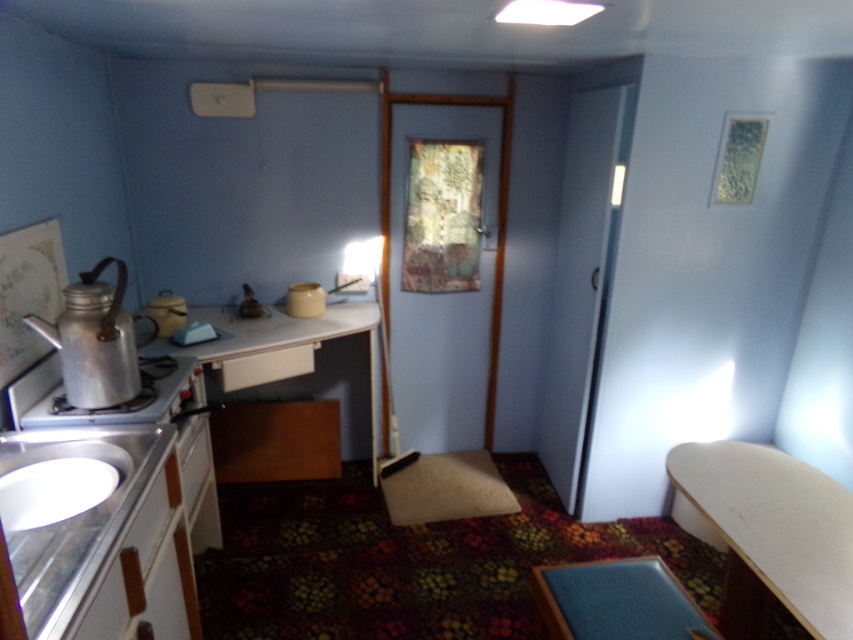
You are trying to place a 12 inch wide baking tray between the white glossy sink at lower left and the silver metallic stove at lower left. Will it fit?

The distance between the white glossy sink at lower left and the silver metallic stove at lower left is 10.76 inches. Since the baking tray is 12 inches wide, it will not fit in the space provided.

You are standing in the room and want to place a new decorative item on the wall. The wall has a grid system where each grid cell is 0.1 units. Where should you place it so that it aligns with the metallic teapot at left?

The metallic teapot at left is located at point [94,340]. To align with it on the grid, place the decorative item at grid cell 5 on the x and 1 on the y axis since 0.533 rounds to 0.5 and 0.111 rounds to 0.1, corresponding to grid cells 5 and 1 respectively.

You are organizing a small dinner party in the room and need to place a large rectangular cake on one of the available surfaces. The cake is too big for the sink area. Which object from the wooden table at center and the white glossy sink at lower left should you choose to place the cake?

The wooden table at center is bigger than the white glossy sink at lower left, so you should place the cake on the wooden table at center.